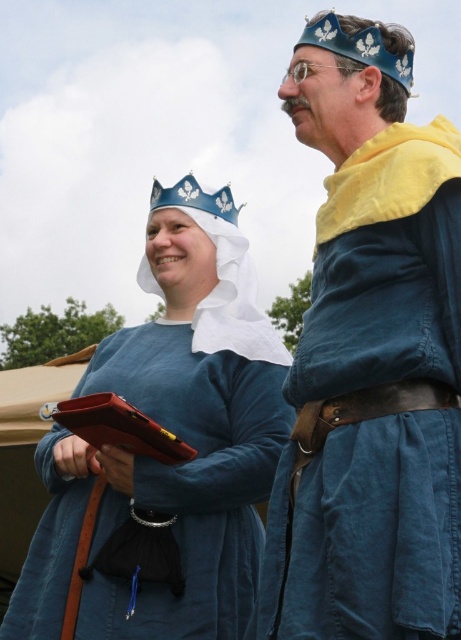
You are a photographer at a medieval event and need to capture a clear shot of both the blue linen dress at center and the blue metallic crown at upper center. Which object will appear larger in your photo?

The blue linen dress at center will appear larger in the photo because it is closer to the viewer than the blue metallic crown at upper center.

You are a costume designer preparing for a play and need to arrange two medieval costumes on a mannequin. The costumes are the blue linen tunic at center and the blue linen dress at center. Based on the image, which costume should be placed higher on the mannequin?

The blue linen tunic at center should be placed higher on the mannequin since it is positioned above the blue linen dress at center in the image.

You are a costume designer preparing for a play. You need to ensure that the blue linen dress at center and the blue metallic crown at upper center fit within a 1.2 meter wide display case. Given their sizes, will both items fit side by side?

The blue linen dress at center is wider than the blue metallic crown at upper center. Since the display case is 1.2 meters wide, both items can fit side by side as long as their combined widths do not exceed the case width. However, without knowing the exact width of the dress, it is impossible to confirm definitively.